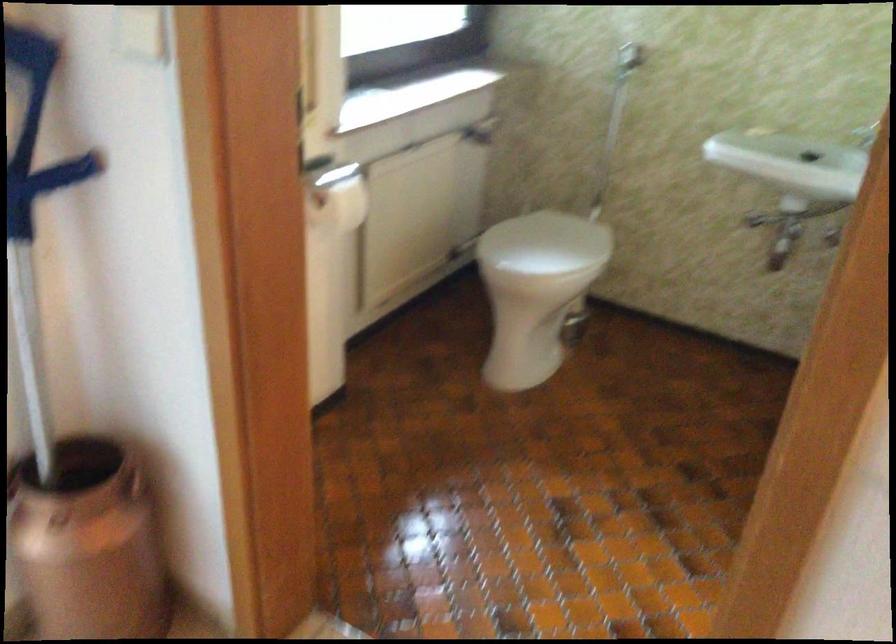
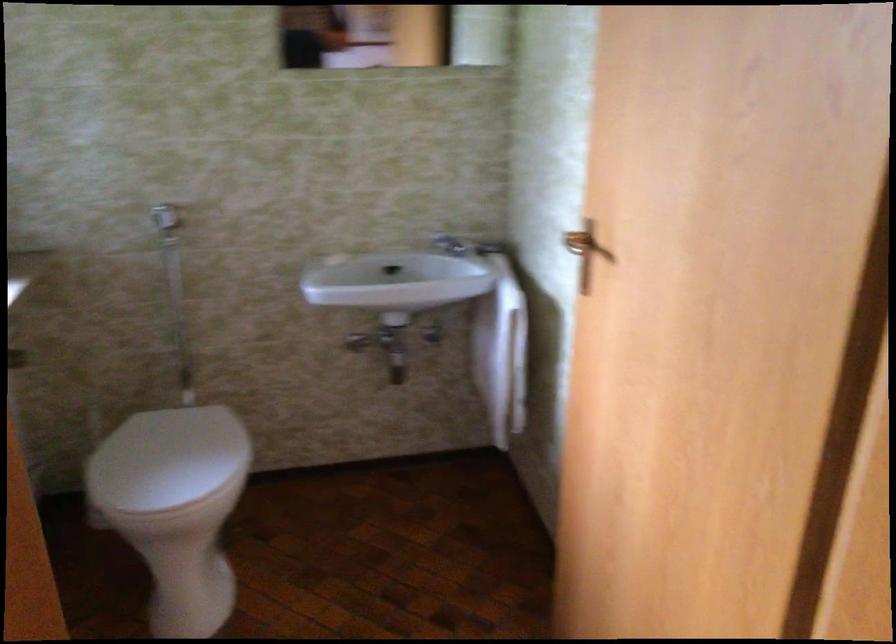
Find the pixel in the second image that matches point 536,242 in the first image.

(167, 460)